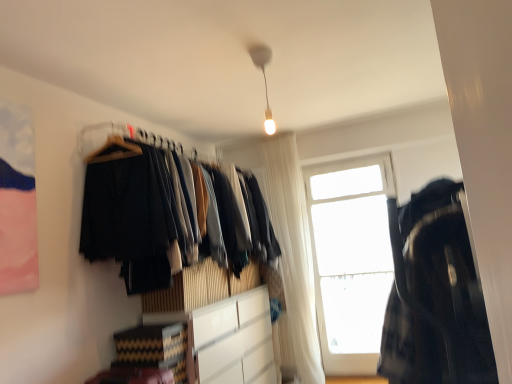
Question: Can you confirm if white matte cabinet at center is shorter than white sheer curtain at center?

Choices:
 (A) yes
 (B) no

Answer: (A)

Question: From a real-world perspective, is white matte cabinet at center positioned under white sheer curtain at center based on gravity?

Choices:
 (A) yes
 (B) no

Answer: (A)

Question: Can you confirm if white matte cabinet at center is positioned to the left of white sheer curtain at center?

Choices:
 (A) no
 (B) yes

Answer: (B)

Question: Is the depth of white matte cabinet at center greater than that of white sheer curtain at center?

Choices:
 (A) no
 (B) yes

Answer: (A)

Question: Is white matte cabinet at center far from white sheer curtain at center?

Choices:
 (A) yes
 (B) no

Answer: (B)

Question: Looking at their shapes, would you say dark fabric clothes at left is wider or thinner than white glossy light bulb at upper center?

Choices:
 (A) thin
 (B) wide

Answer: (B)

Question: Considering their positions, is dark fabric clothes at left located in front of or behind white glossy light bulb at upper center?

Choices:
 (A) behind
 (B) front

Answer: (B)

Question: From a real-world perspective, relative to white glossy light bulb at upper center, is dark fabric clothes at left vertically above or below?

Choices:
 (A) above
 (B) below

Answer: (B)

Question: Based on their positions, is dark fabric clothes at left located to the left or right of white glossy light bulb at upper center?

Choices:
 (A) right
 (B) left

Answer: (B)

Question: Is point (x=454, y=221) closer or farther from the camera than point (x=314, y=200)?

Choices:
 (A) closer
 (B) farther

Answer: (A)

Question: Looking at the image, does dark plaid shirt at right seem bigger or smaller compared to transparent glass window at upper right?

Choices:
 (A) small
 (B) big

Answer: (B)

Question: Considering the relative positions of dark plaid shirt at right and transparent glass window at upper right in the image provided, is dark plaid shirt at right to the left or to the right of transparent glass window at upper right?

Choices:
 (A) right
 (B) left

Answer: (B)

Question: Considering the positions of dark plaid shirt at right and transparent glass window at upper right in the image, is dark plaid shirt at right taller or shorter than transparent glass window at upper right?

Choices:
 (A) tall
 (B) short

Answer: (B)

Question: Is white sheer curtain at center bigger or smaller than white glossy light bulb at upper center?

Choices:
 (A) small
 (B) big

Answer: (B)

Question: Is point (301, 221) closer or farther from the camera than point (264, 54)?

Choices:
 (A) farther
 (B) closer

Answer: (A)